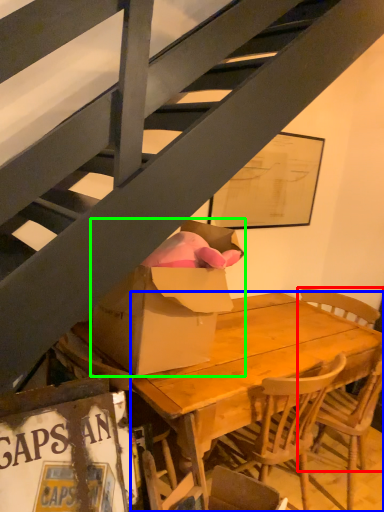
Question: Which object is the farthest from chair (highlighted by a red box)? Choose among these: desk (highlighted by a blue box) or box (highlighted by a green box).

Choices:
 (A) desk
 (B) box

Answer: (B)